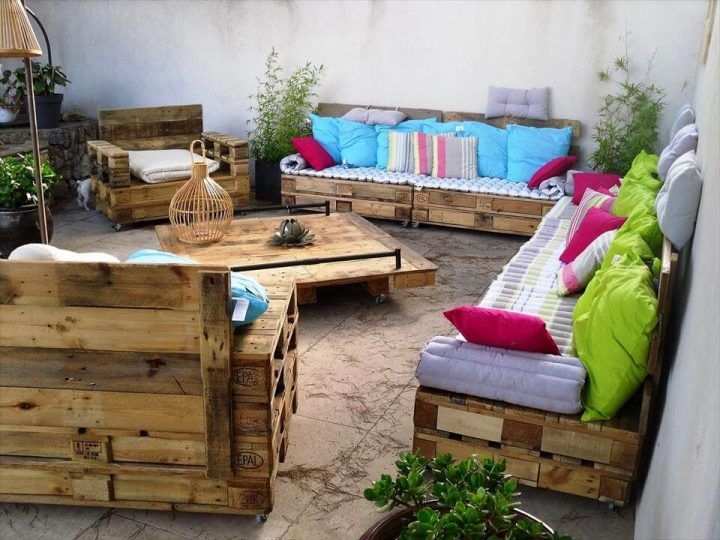
Image resolution: width=720 pixels, height=540 pixels. Find the location of `sectionals`. sectionals is located at coordinates (150, 154), (417, 167), (552, 266), (127, 330).